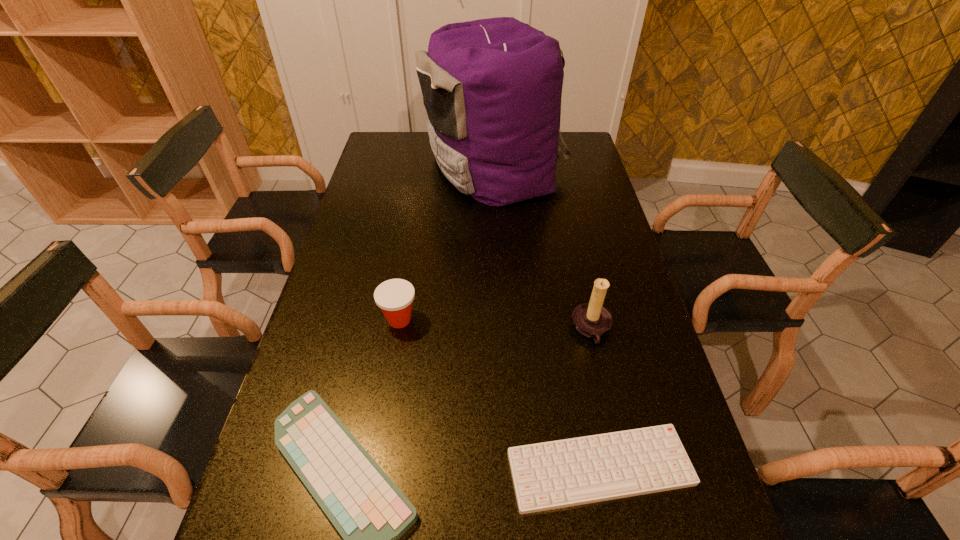
This screenshot has height=540, width=960. Identify the location of free region at the far left corner of the desktop. (407, 140).

At what (x,y) coordinates should I click in order to perform the action: click on vacant space in between the farthest object and the third shortest object. Please return your answer as a coordinate pair (x, y). The image size is (960, 540). Looking at the image, I should click on (446, 244).

I want to click on free space between the right computer keyboard and the candle holder, so click(x=596, y=399).

Locate an element on the screen. Image resolution: width=960 pixels, height=540 pixels. free space that is in between the right computer keyboard and the Dixie cup is located at coordinates (500, 394).

Identify the location of free space between the tallest object and the candle holder. (542, 249).

This screenshot has height=540, width=960. In order to click on free space between the right computer keyboard and the candle holder in this screenshot , I will do `click(596, 399)`.

At what (x,y) coordinates should I click in order to perform the action: click on vacant area that lies between the candle holder and the third shortest object. Please return your answer as a coordinate pair (x, y). Image resolution: width=960 pixels, height=540 pixels. Looking at the image, I should click on (495, 325).

Find the location of a particular element. object identified as the third closest to the right computer keyboard is located at coordinates (394, 297).

Identify the location of object that is the second closest one to the right computer keyboard. (591, 319).

Identify the location of vacant region that satisfies the following two spatial constraints: 1. on the back side of the right computer keyboard; 2. on the front pocket of the tallest object. (543, 167).